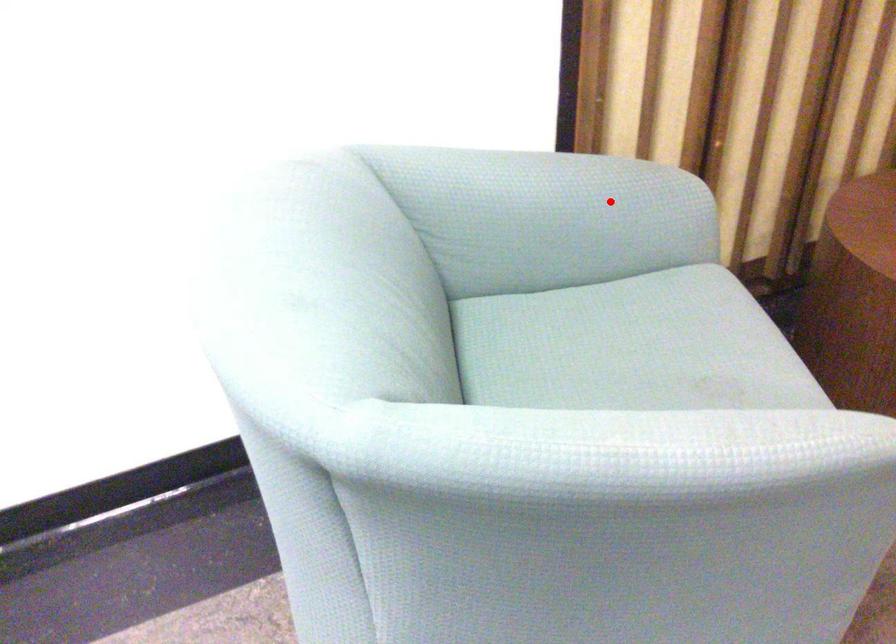
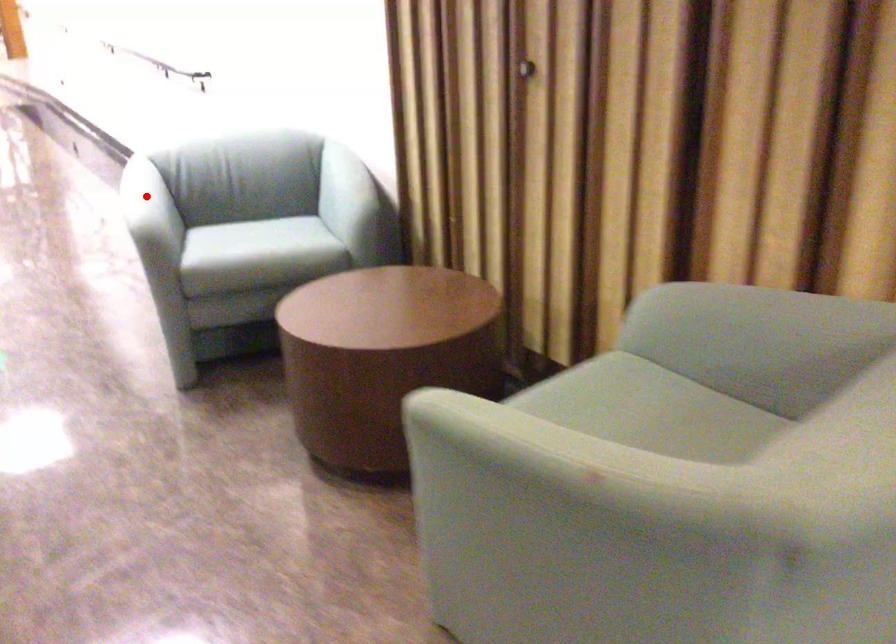
I am providing you with two images of the same scene from different viewpoints. A red point is marked on the first image and another point is marked on the second image. Does the point marked in image1 correspond to the same location as the one in image2?

No